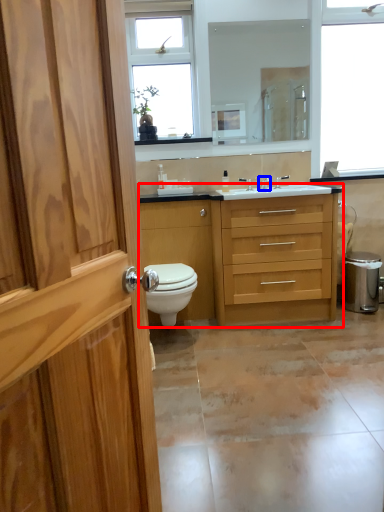
Question: Which object appears closest to the camera in this image, bathroom cabinet (highlighted by a red box) or tap (highlighted by a blue box)?

Choices:
 (A) bathroom cabinet
 (B) tap

Answer: (A)